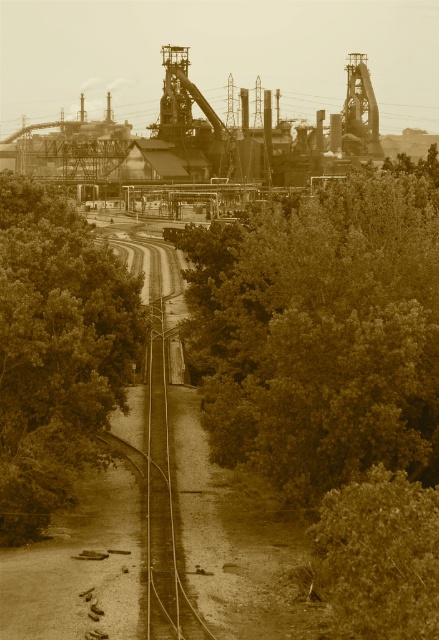
Does green leafy tree at center appear on the left side of green leafy tree at left?

No, green leafy tree at center is not to the left of green leafy tree at left.

Is green leafy tree at center bigger than green leafy tree at left?

Correct, green leafy tree at center is larger in size than green leafy tree at left.

Does point (301, 451) lie in front of point (63, 424)?

That is True.

Where is `green leafy tree at center`? Image resolution: width=439 pixels, height=640 pixels. green leafy tree at center is located at coordinates (321, 332).